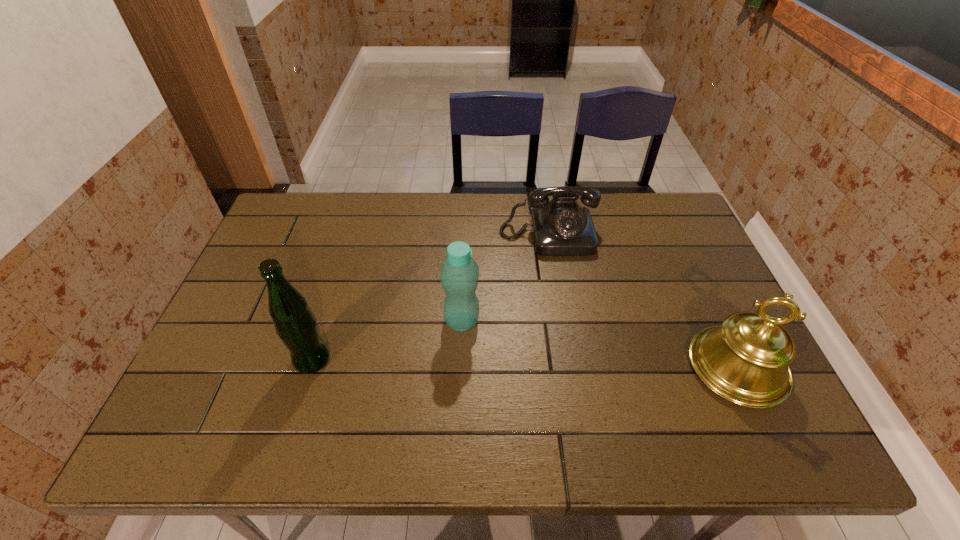
You are a GUI agent. You are given a task and a screenshot of the screen. Output one action in this format:
    pyautogui.click(x=<x>, y=<y>)
    Task: Click on the vacant space that satisfies the following two spatial constraints: 1. on the front side of the tallest object; 2. on the left side of the bell
    Image resolution: width=960 pixels, height=540 pixels.
    Given the screenshot: What is the action you would take?
    pyautogui.click(x=310, y=367)